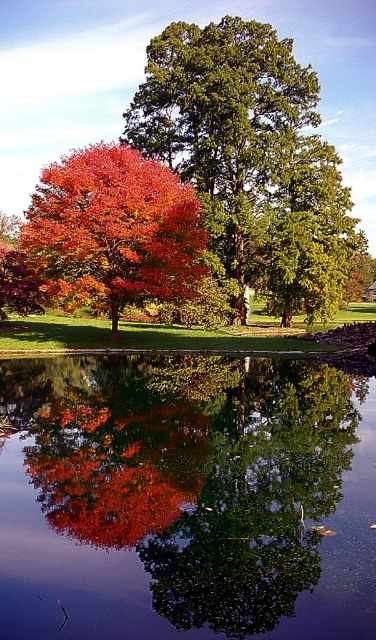
Question: Does shiny red maple tree at left appear over shiny red leaves at center?

Choices:
 (A) yes
 (B) no

Answer: (A)

Question: Based on their relative distances, which object is farther from the shiny red leaves at center?

Choices:
 (A) shiny red maple tree at left
 (B) smooth glass lake at center
 (C) green textured tree at center

Answer: (C)

Question: Which object is closer to the camera taking this photo?

Choices:
 (A) green textured tree at center
 (B) shiny red maple tree at left
 (C) shiny red leaves at center
 (D) smooth glass lake at center

Answer: (D)

Question: Is shiny red maple tree at left to the right of shiny red leaves at center from the viewer's perspective?

Choices:
 (A) yes
 (B) no

Answer: (B)

Question: Which point appears farthest from the camera in this image?

Choices:
 (A) (195, 460)
 (B) (154, 461)
 (C) (274, 44)
 (D) (112, 161)

Answer: (C)

Question: Where is green textured tree at center located in relation to shiny red leaves at center in the image?

Choices:
 (A) right
 (B) left

Answer: (A)